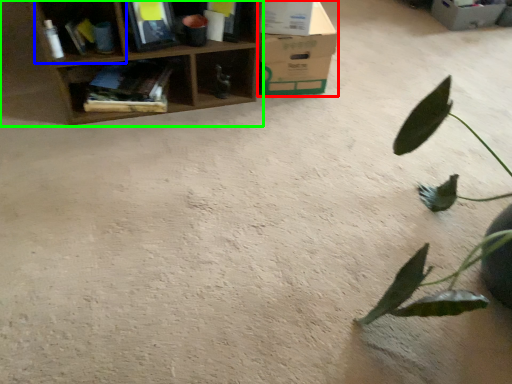
Question: Which object is positioned closest to cardboard box (highlighted by a red box)? Select from shelf (highlighted by a blue box) and shelf (highlighted by a green box).

Choices:
 (A) shelf
 (B) shelf

Answer: (B)